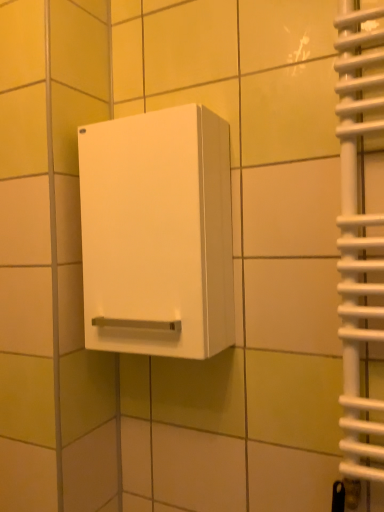
Question: Should I look upward or downward to see white matte cabinet at center?

Choices:
 (A) down
 (B) up

Answer: (B)